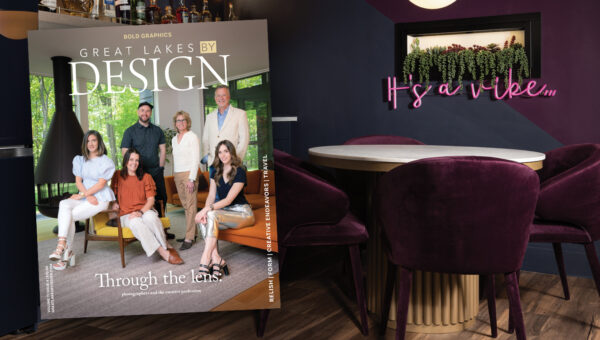
Identify the location of chairs around the table. This screenshot has height=340, width=600. (313, 186), (419, 209), (562, 188), (395, 137), (329, 291).